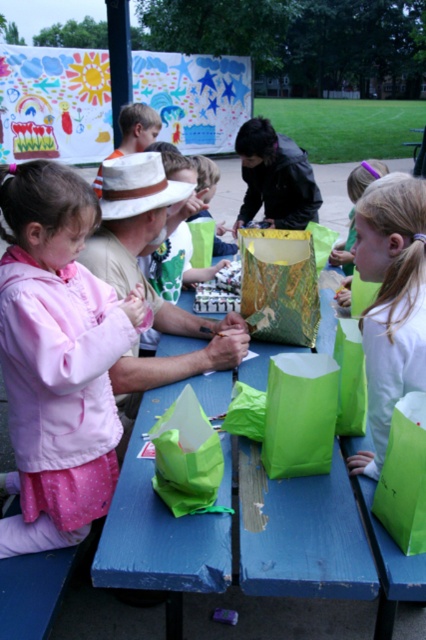
Question: Which object is closer to the camera taking this photo?

Choices:
 (A) blue wood table at center
 (B) white paper bag at center
 (C) matte green paper bag at center

Answer: (A)

Question: Does pink fabric dress at lower left appear on the right side of white paper bag at center?

Choices:
 (A) yes
 (B) no

Answer: (B)

Question: Which point is closer to the camera taking this photo?

Choices:
 (A) (302, 572)
 (B) (232, 244)

Answer: (A)

Question: Which object is positioned farthest from the white paper bag at center?

Choices:
 (A) pink fabric dress at lower left
 (B) matte green paper bag at center
 (C) blue wood table at center

Answer: (B)

Question: Can you confirm if blue wood table at center is thinner than matte green paper bag at center?

Choices:
 (A) no
 (B) yes

Answer: (A)

Question: Can you confirm if pink fabric dress at lower left is smaller than blue wood table at center?

Choices:
 (A) no
 (B) yes

Answer: (A)